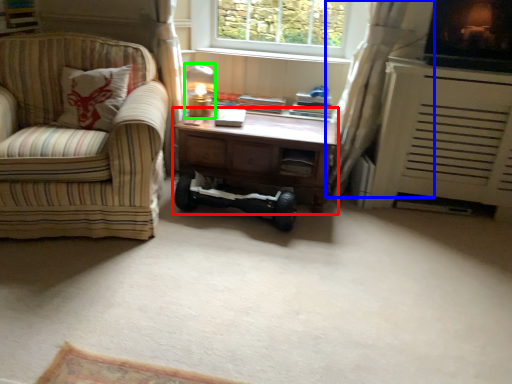
Question: Which object is the farthest from desk (highlighted by a red box)? Choose among these: curtain (highlighted by a blue box) or table lamp (highlighted by a green box).

Choices:
 (A) curtain
 (B) table lamp

Answer: (B)